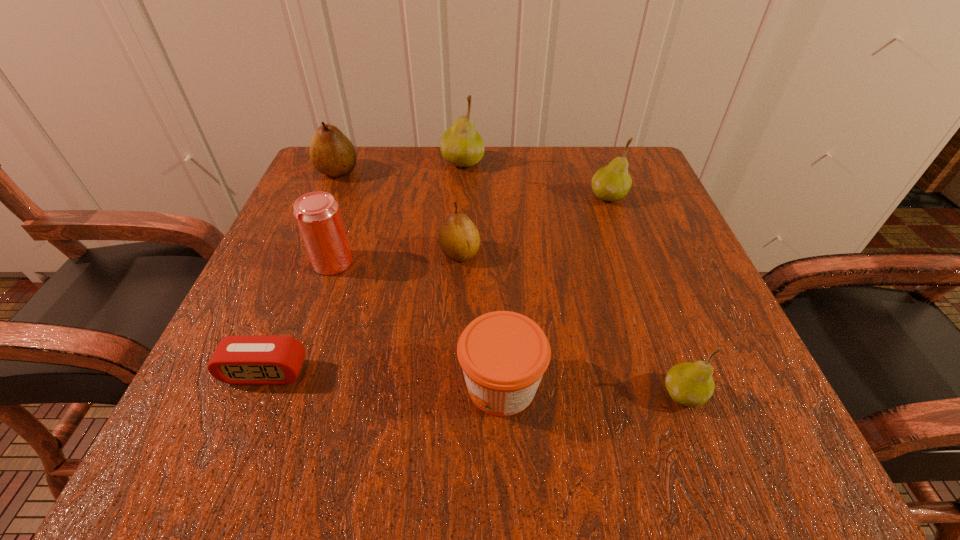
What are the coordinates of `free space that satisfies the following two spatial constraints: 1. on the front-facing side of the pink alarm clock; 2. on the left side of the smallest green pear` in the screenshot? It's located at (256, 394).

Locate an element on the screen. The height and width of the screenshot is (540, 960). free space that satisfies the following two spatial constraints: 1. on the front-facing side of the smallest green pear; 2. on the left side of the pink alarm clock is located at coordinates (256, 394).

Find the location of `free space that satisfies the following two spatial constraints: 1. on the front side of the fourth farthest pear; 2. on the left side of the farthest green pear`. free space that satisfies the following two spatial constraints: 1. on the front side of the fourth farthest pear; 2. on the left side of the farthest green pear is located at coordinates (458, 253).